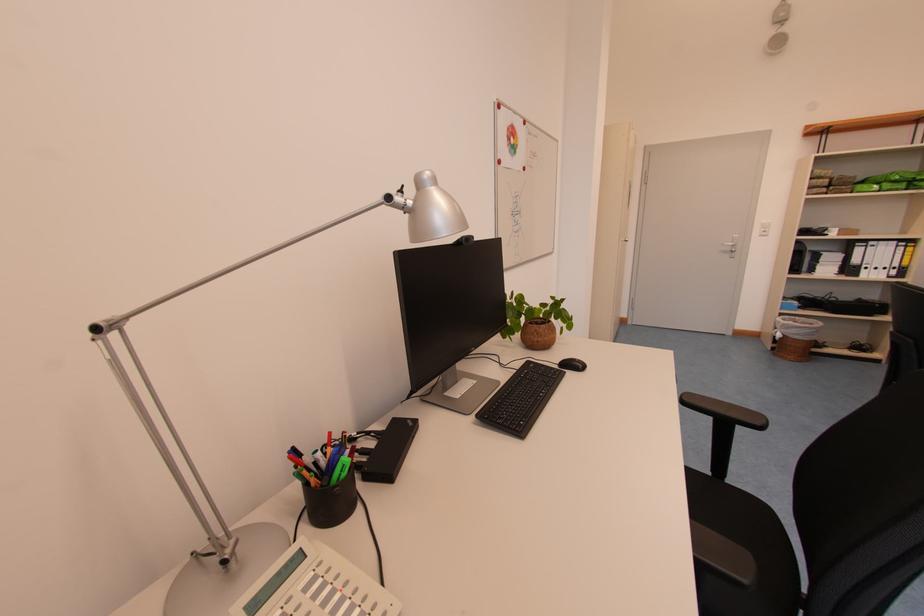
Which object does [295,459] point to?

It refers to a red marker.